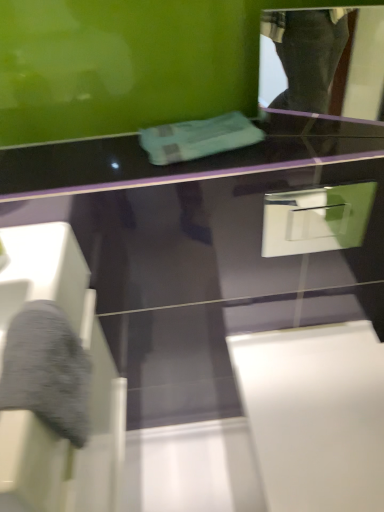
Question: Is white glossy drawer at upper right to the left or to the right of teal fabric towel at center in the image?

Choices:
 (A) right
 (B) left

Answer: (A)

Question: From the image's perspective, is white glossy drawer at upper right located above or below teal fabric towel at center?

Choices:
 (A) above
 (B) below

Answer: (B)

Question: Estimate the real-world distances between objects in this image. Which object is farther from the glossy plastic mirror at upper right?

Choices:
 (A) teal fabric towel at center
 (B) white glossy drawer at upper right

Answer: (A)

Question: Which is nearer to the white glossy drawer at upper right?

Choices:
 (A) teal fabric towel at center
 (B) glossy plastic mirror at upper right

Answer: (A)